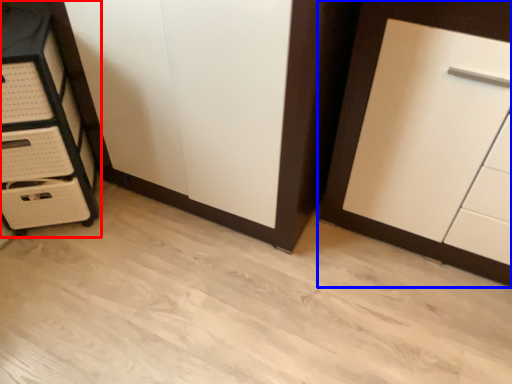
Question: Among these objects, which one is nearest to the camera, chest of drawers (highlighted by a red box) or cupboard (highlighted by a blue box)?

Choices:
 (A) chest of drawers
 (B) cupboard

Answer: (B)